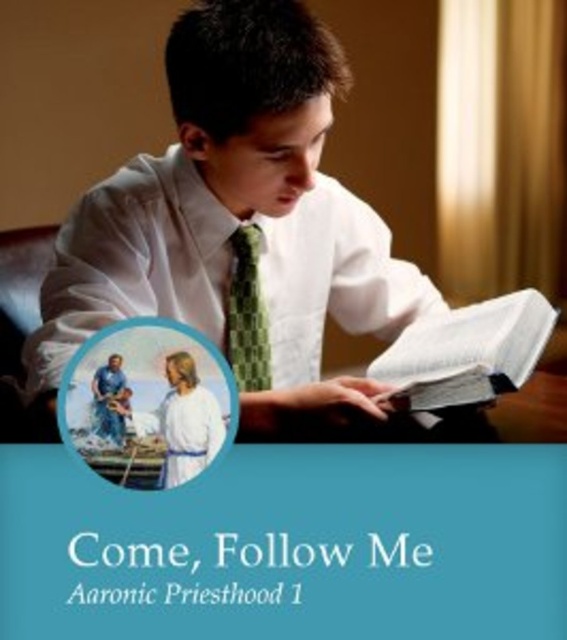
Does blue paper at bottom have a greater width compared to green checkered tie at center?

Yes.

Is blue paper at bottom below green checkered tie at center?

Yes, blue paper at bottom is below green checkered tie at center.

Which is behind, point (413, 570) or point (235, 339)?

The point (235, 339) is more distant.

At what (x,y) coordinates should I click in order to perform the action: click on blue paper at bottom. Please return your answer as a coordinate pair (x, y). Image resolution: width=567 pixels, height=640 pixels. Looking at the image, I should click on (290, 547).

Which of these two, white smooth shirt at center or green checkered tie at center, stands taller?

white smooth shirt at center is taller.

Find the location of a particular element. The height and width of the screenshot is (640, 567). white smooth shirt at center is located at coordinates (240, 224).

Between white smooth shirt at center and white paper book at center, which one appears on the left side from the viewer's perspective?

Positioned to the left is white smooth shirt at center.

How far apart are white smooth shirt at center and white paper book at center?

white smooth shirt at center is 10.60 inches from white paper book at center.

Between point (332, 70) and point (471, 374), which one is positioned behind?

Point (332, 70)

This screenshot has width=567, height=640. In order to click on white smooth shirt at center in this screenshot , I will do `click(240, 224)`.